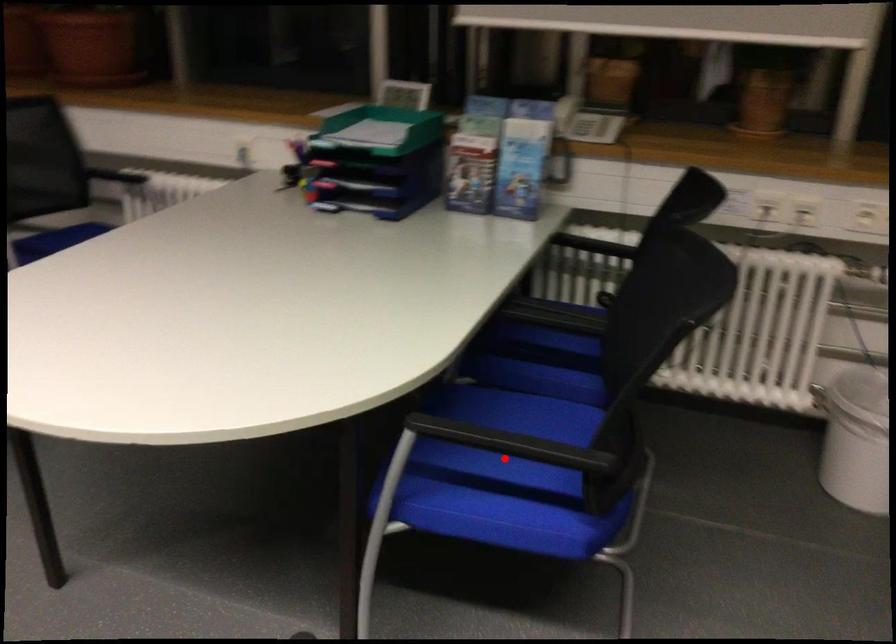
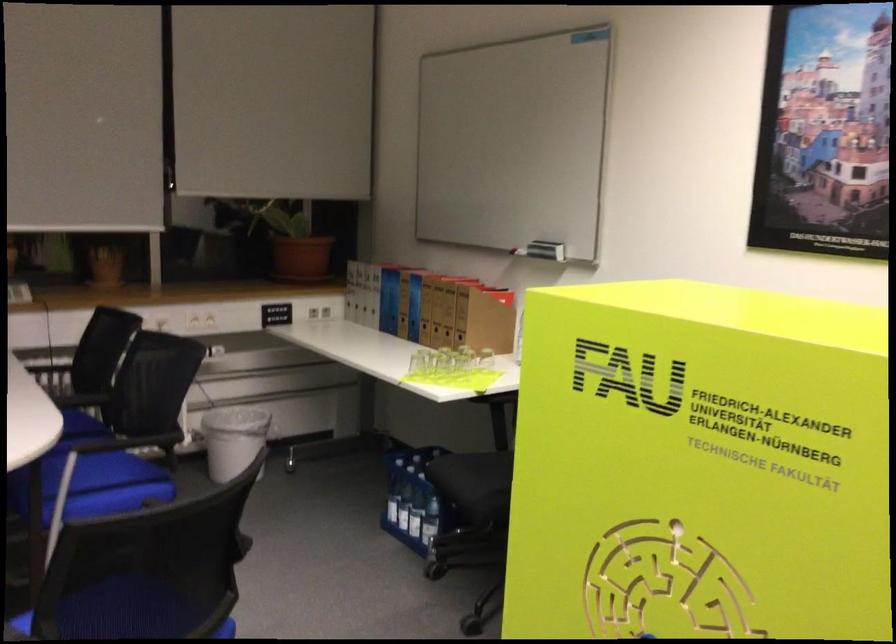
In the second image, find the point that corresponds to the highlighted location in the first image.

(95, 485)